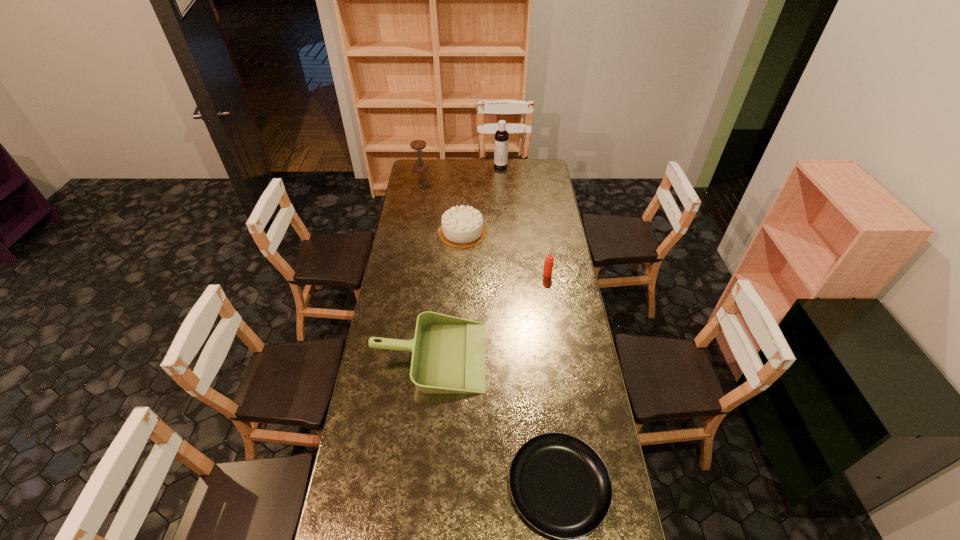
The image size is (960, 540). Find the location of `blank space that satisfies the following two spatial constraints: 1. on the front side of the birthday cake; 2. on the left side of the hourglass`. blank space that satisfies the following two spatial constraints: 1. on the front side of the birthday cake; 2. on the left side of the hourglass is located at coordinates (409, 232).

Find the location of a particular element. The image size is (960, 540). blank area in the image that satisfies the following two spatial constraints: 1. on the front side of the third nearest object; 2. on the right side of the third farthest object is located at coordinates (461, 274).

Locate an element on the screen. Image resolution: width=960 pixels, height=540 pixels. free region that satisfies the following two spatial constraints: 1. on the front side of the Tabasco sauce; 2. on the left side of the birthday cake is located at coordinates (461, 274).

This screenshot has height=540, width=960. What are the coordinates of `free space that satisfies the following two spatial constraints: 1. on the label side of the dishwasher detergent; 2. on the back side of the Tabasco sauce` in the screenshot? It's located at click(x=508, y=274).